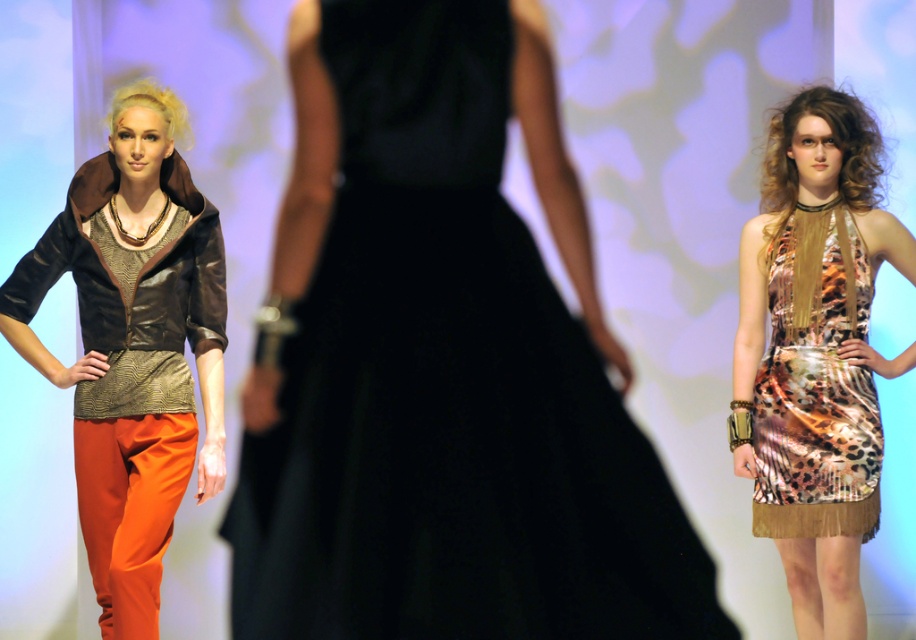
Question: Estimate the real-world distances between objects in this image. Which object is closer to the matte brown leather jacket at left?

Choices:
 (A) leopard print dress at right
 (B) leopard print satin dress at right

Answer: (A)

Question: Based on their relative distances, which object is farther from the matte brown leather jacket at left?

Choices:
 (A) leopard print satin dress at right
 (B) leopard print dress at right

Answer: (A)

Question: Does matte brown leather jacket at left have a larger size compared to leopard print dress at right?

Choices:
 (A) no
 (B) yes

Answer: (A)

Question: Can you confirm if leopard print dress at right is bigger than leopard print satin dress at right?

Choices:
 (A) yes
 (B) no

Answer: (A)

Question: Does matte brown leather jacket at left come in front of leopard print dress at right?

Choices:
 (A) no
 (B) yes

Answer: (B)

Question: Which object is closer to the camera taking this photo?

Choices:
 (A) leopard print satin dress at right
 (B) leopard print dress at right
 (C) matte brown leather jacket at left

Answer: (C)